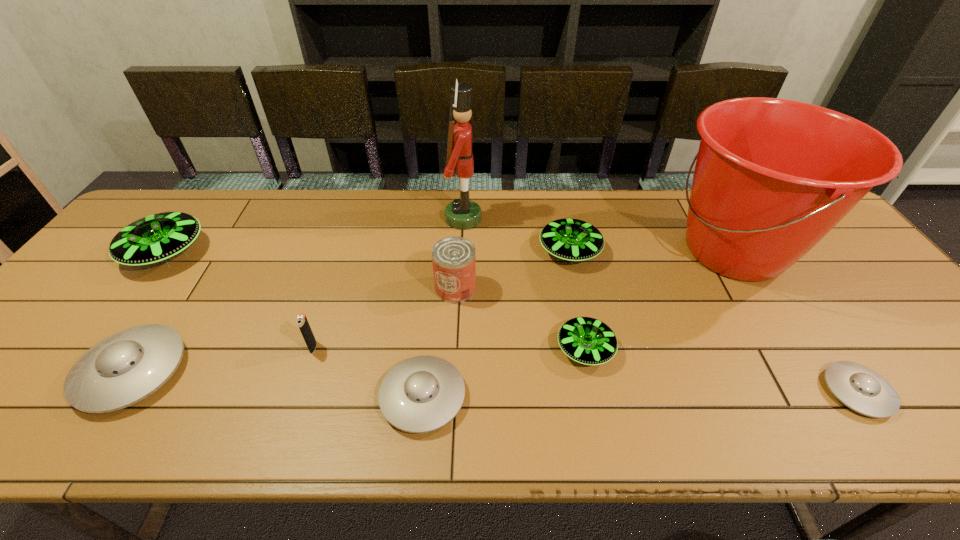
In order to click on free space located 0.370m with the handle attached to the rim of the second tallest object in this screenshot , I will do tap(532, 251).

The height and width of the screenshot is (540, 960). In order to click on vacant space located on the front of the can in this screenshot , I will do `click(453, 332)`.

Where is `blank space located on the front of the biggest green saucer`? The image size is (960, 540). blank space located on the front of the biggest green saucer is located at coordinates [x=134, y=294].

Locate an element on the screen. The image size is (960, 540). vacant space located 0.310m on the right of the third object from left to right is located at coordinates (449, 347).

Locate an element on the screen. The height and width of the screenshot is (540, 960). vacant space situated 0.200m on the back of the fifth shortest saucer is located at coordinates (557, 193).

This screenshot has height=540, width=960. What are the coordinates of `vacant space located on the left of the leftmost gray saucer` in the screenshot? It's located at pyautogui.click(x=51, y=372).

Where is `vacant space located 0.340m on the back of the smallest green saucer`? This screenshot has width=960, height=540. vacant space located 0.340m on the back of the smallest green saucer is located at coordinates (563, 237).

The width and height of the screenshot is (960, 540). Find the location of `blank space located on the back of the second gray saucer from right to left`. blank space located on the back of the second gray saucer from right to left is located at coordinates (436, 267).

Find the location of a particular element. vacant space located 0.150m on the back of the smallest gray saucer is located at coordinates (804, 314).

Find the location of a particular element. The image size is (960, 540). nutcracker that is at the far edge is located at coordinates (463, 213).